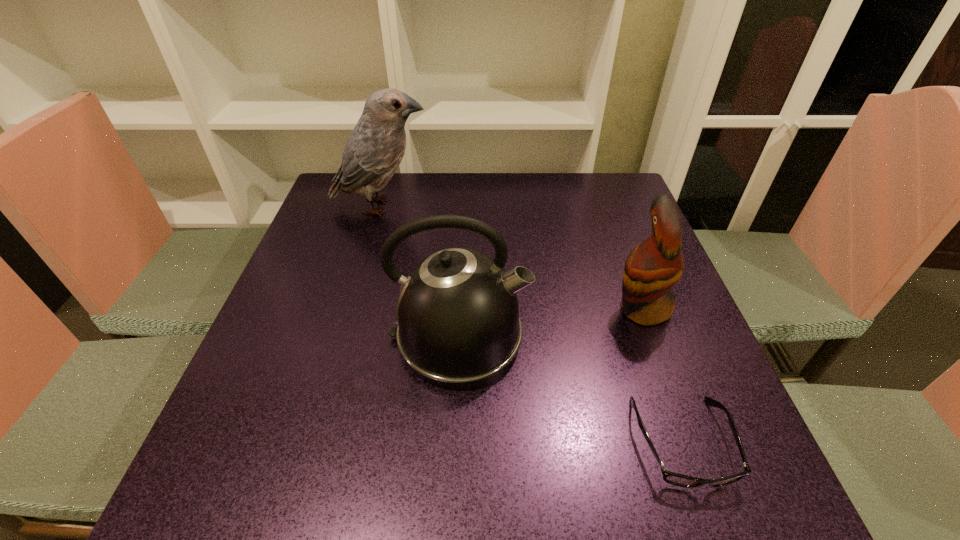
Locate an element on the screen. The image size is (960, 540). the left parrot is located at coordinates (374, 150).

This screenshot has height=540, width=960. Find the location of `the farther parrot`. the farther parrot is located at coordinates (374, 150).

The image size is (960, 540). In order to click on kettle in this screenshot , I will do `click(458, 320)`.

Where is `the shorter parrot`? The width and height of the screenshot is (960, 540). the shorter parrot is located at coordinates (653, 267).

Locate an element on the screen. Image resolution: width=960 pixels, height=540 pixels. the nearer parrot is located at coordinates (653, 267).

Identify the location of the shortest object. (672, 478).

Identify the location of the nearest object. The image size is (960, 540). (672, 478).

Locate an element on the screen. Image resolution: width=960 pixels, height=540 pixels. vacant space situated on the front-facing side of the farthest object is located at coordinates (542, 206).

Image resolution: width=960 pixels, height=540 pixels. In order to click on vacant space located 0.230m on the spout of the kettle in this screenshot , I will do pos(645,338).

At what (x,y) coordinates should I click in order to perform the action: click on free space located 0.280m on the face of the nearer parrot. Please return your answer as a coordinate pair (x, y). This screenshot has height=540, width=960. Looking at the image, I should click on (479, 308).